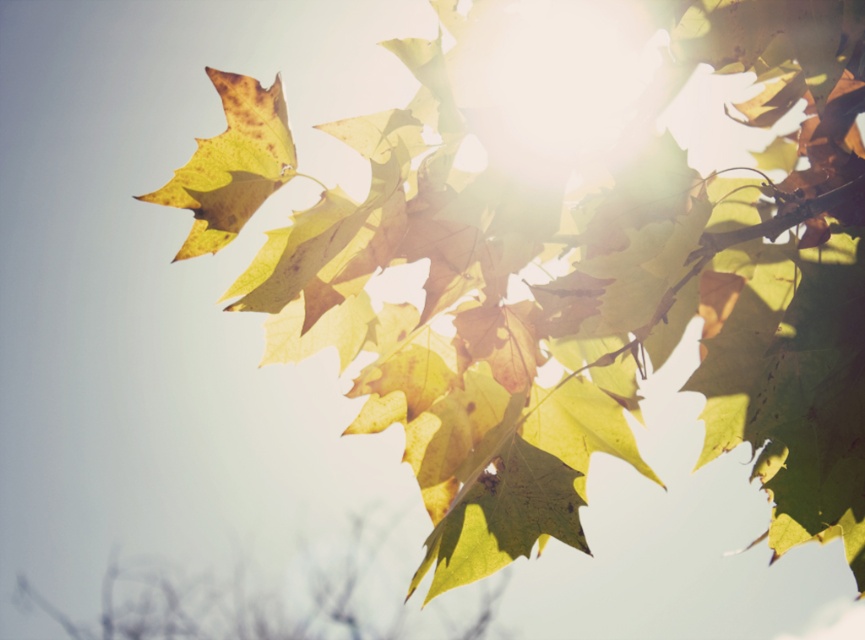
Question: Does yellow-green matte leaf at center appear over yellow-green matte leaf at upper left?

Choices:
 (A) no
 (B) yes

Answer: (A)

Question: Is yellow-green matte leaf at center further to camera compared to yellow-green matte leaf at upper left?

Choices:
 (A) no
 (B) yes

Answer: (B)

Question: Which of the following is the closest to the observer?

Choices:
 (A) yellow-green matte leaf at center
 (B) yellow-green matte leaf at upper left

Answer: (B)

Question: Which of the following is the closest to the observer?

Choices:
 (A) yellow-green matte leaf at center
 (B) yellow-green matte leaf at upper left

Answer: (B)

Question: Is yellow-green matte leaf at center further to camera compared to yellow-green matte leaf at upper left?

Choices:
 (A) no
 (B) yes

Answer: (B)